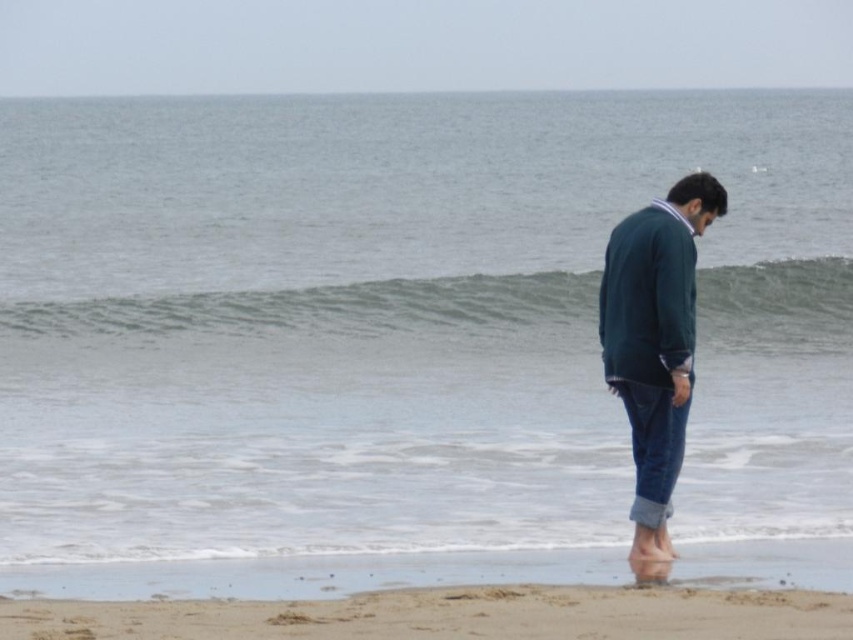
You are a lifeguard on duty and need to assess the beach conditions. Which area, the green textured wave at center or the smooth beige sand at lower center, has a greater width?

The green textured wave at center might be wider than smooth beige sand at lower center according to the description.